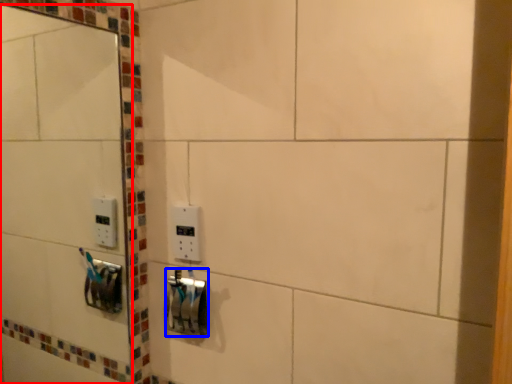
Question: Which object is further to the camera taking this photo, mirror (highlighted by a red box) or lock (highlighted by a blue box)?

Choices:
 (A) mirror
 (B) lock

Answer: (B)